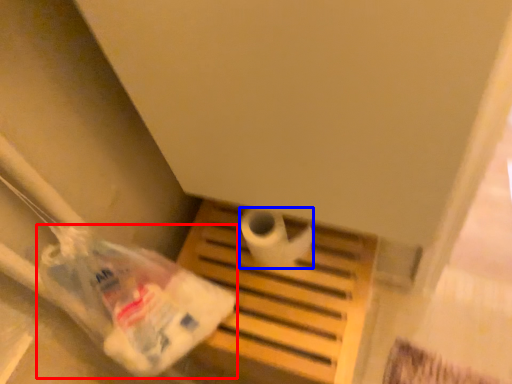
Question: Among these objects, which one is farthest to the camera, plastic bag (highlighted by a red box) or toilet paper (highlighted by a blue box)?

Choices:
 (A) plastic bag
 (B) toilet paper

Answer: (B)